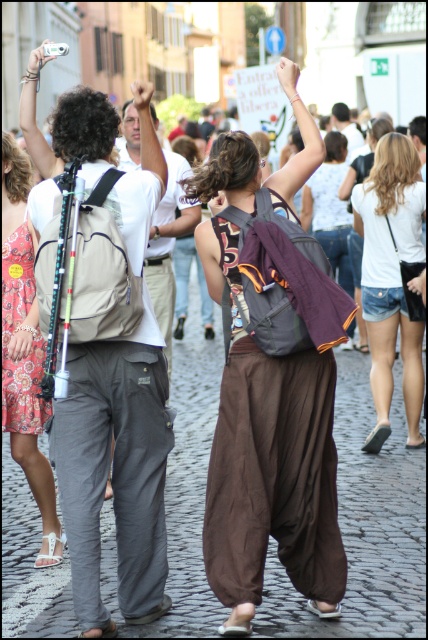
You are standing at the origin point of the image coordinate system. You see two points, point (309, 116) and point (29, 74). Which point is closer to you?

Point (309, 116) is in front of point (29, 74), so it is closer to you.

You are a photographer trying to capture the crowd in the background. You notice the matte gray backpack at center and the matte white camera at upper left. Which object is blocking your view of the crowd more?

The matte gray backpack at center is blocking your view of the crowd more because it is in front of the matte white camera at upper left.

You are standing at the center of the image and want to find the floral print dress at center. According to the coordinates provided, in which direction should you look to locate it?

The floral print dress at center is located at coordinates point (24, 348). Since the y coordinate is 0.058, which is closer to 0, you should look downward from the center to locate it.